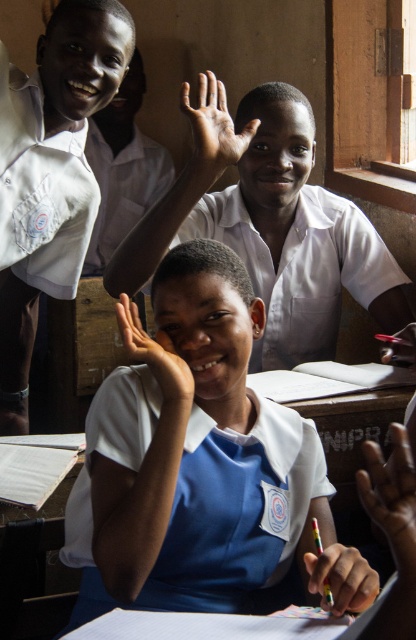
Can you confirm if white glossy uniform shirt at upper center is wider than white matte hand at center?

Indeed, white glossy uniform shirt at upper center has a greater width compared to white matte hand at center.

Looking at this image, is white glossy uniform shirt at upper center positioned behind white matte hand at center?

That is True.

Find the location of a particular element. The image size is (416, 640). white glossy uniform shirt at upper center is located at coordinates (49, 173).

This screenshot has width=416, height=640. Identify the location of white glossy uniform shirt at upper center. (49, 173).

Does point (349, 547) come farther from viewer compared to point (133, 358)?

No, (349, 547) is closer to viewer.

Does smooth yellow pencil at center have a larger size compared to white matte hand at center?

No.

Between point (319, 589) and point (193, 390), which one is positioned in front?

Positioned in front is point (319, 589).

Identify the location of smooth yellow pencil at center. The height and width of the screenshot is (640, 416). (337, 573).

Is white smooth shirt at upper center smaller than metallic pen at upper right?

Actually, white smooth shirt at upper center might be larger than metallic pen at upper right.

Is white smooth shirt at upper center to the left of metallic pen at upper right from the viewer's perspective?

Yes, white smooth shirt at upper center is to the left of metallic pen at upper right.

In order to click on white smooth shirt at upper center in this screenshot , I will do `click(123, 189)`.